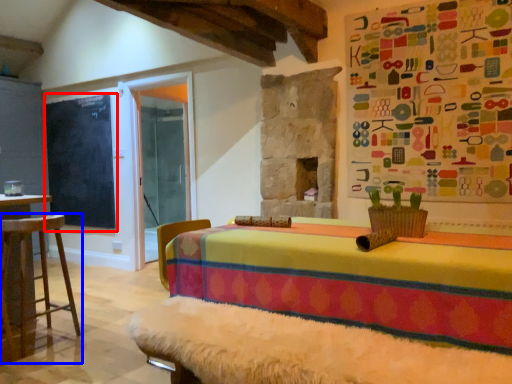
Question: Which point is closer to the camera, bulletin board (highlighted by a red box) or furniture (highlighted by a blue box)?

Choices:
 (A) bulletin board
 (B) furniture

Answer: (B)